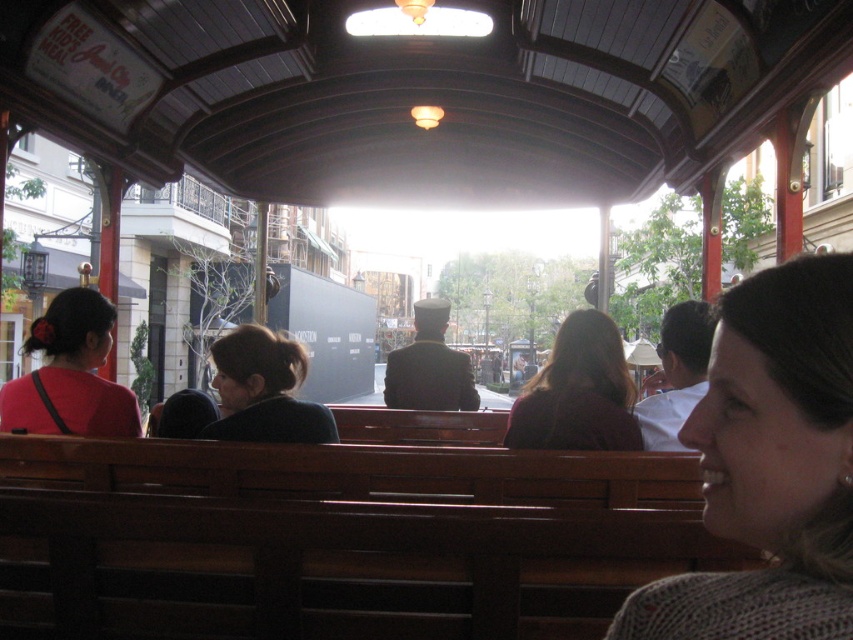
Question: Which of the following is the farthest from the observer?

Choices:
 (A) dark brown hair at center
 (B) matte red shirt at left
 (C) gray knitted sweater at lower right

Answer: (A)

Question: Where is gray knitted sweater at lower right located in relation to dark brown hair at center in the image?

Choices:
 (A) left
 (B) right

Answer: (A)

Question: Which point appears closest to the camera in this image?

Choices:
 (A) (80, 401)
 (B) (215, 388)
 (C) (532, 401)
 (D) (796, 509)

Answer: (D)

Question: Observing the image, what is the correct spatial positioning of matte red shirt at left in reference to dark blue sweater at center?

Choices:
 (A) right
 (B) left

Answer: (B)

Question: Which object is positioned farthest from the dark blue sweater at center?

Choices:
 (A) matte red shirt at left
 (B) gray knitted sweater at lower right

Answer: (B)

Question: Can you confirm if gray knitted sweater at lower right is thinner than dark blue sweater at center?

Choices:
 (A) yes
 (B) no

Answer: (A)